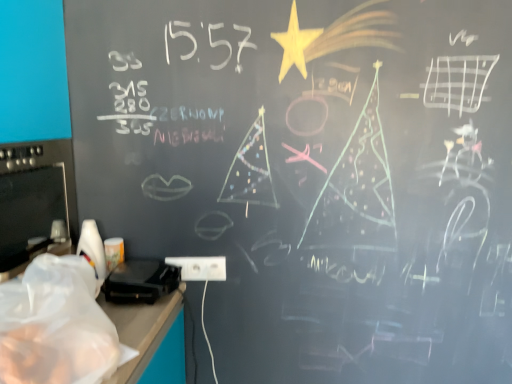
This screenshot has height=384, width=512. I want to click on transparent plastic bag at lower left, so click(x=154, y=335).

What do you see at coordinates (200, 268) in the screenshot? I see `white plastic electric outlet at lower center` at bounding box center [200, 268].

Locate an element on the screen. black plastic toaster at lower left is located at coordinates (141, 281).

Who is bigger, transparent plastic bag at lower left or white plastic electric outlet at lower center?

transparent plastic bag at lower left is bigger.

From the image's perspective, which one is positioned lower, transparent plastic bag at lower left or white plastic electric outlet at lower center?

white plastic electric outlet at lower center is shown below in the image.

Which object is further away from the camera taking this photo, transparent plastic bag at lower left or white plastic electric outlet at lower center?

white plastic electric outlet at lower center is behind.

Is transparent plastic bag at lower left positioned beyond the bounds of white plastic electric outlet at lower center?

Absolutely, transparent plastic bag at lower left is external to white plastic electric outlet at lower center.

Is white plastic electric outlet at lower center shorter than black plastic toaster at lower left?

Yes.

Is white plastic electric outlet at lower center not near black plastic toaster at lower left?

Actually, white plastic electric outlet at lower center and black plastic toaster at lower left are a little close together.

Based on the photo, is white plastic electric outlet at lower center bigger or smaller than black plastic toaster at lower left?

In the image, white plastic electric outlet at lower center appears to be smaller than black plastic toaster at lower left.

Which of these two, white plastic electric outlet at lower center or black plastic toaster at lower left, is wider?

With larger width is black plastic toaster at lower left.

Could you tell me if black plastic toaster at lower left is turned towards white plastic electric outlet at lower center?

No, black plastic toaster at lower left is not oriented towards white plastic electric outlet at lower center.

Is black plastic toaster at lower left placed right next to white plastic electric outlet at lower center?

black plastic toaster at lower left is not next to white plastic electric outlet at lower center, and they're not touching.

From a real-world perspective, is black plastic toaster at lower left over white plastic electric outlet at lower center?

Yes, from a real-world perspective, black plastic toaster at lower left is over white plastic electric outlet at lower center

Between black plastic toaster at lower left and white plastic electric outlet at lower center, which one has more height?

Standing taller between the two is black plastic toaster at lower left.

Does point (108, 284) come farther from viewer compared to point (159, 377)?

Yes.

Who is shorter, black plastic toaster at lower left or transparent plastic bag at lower left?

black plastic toaster at lower left is shorter.

Measure the distance from black plastic toaster at lower left to transparent plastic bag at lower left.

A distance of 5.01 inches exists between black plastic toaster at lower left and transparent plastic bag at lower left.

Who is more distant, black plastic toaster at lower left or transparent plastic bag at lower left?

black plastic toaster at lower left.

Which point is more distant from viewer, (x=215, y=260) or (x=176, y=378)?

The point (x=215, y=260) is more distant.

From the image's perspective, would you say white plastic electric outlet at lower center is positioned over transparent plastic bag at lower left?

Actually, white plastic electric outlet at lower center appears below transparent plastic bag at lower left in the image.

Considering the relative positions of white plastic electric outlet at lower center and transparent plastic bag at lower left in the image provided, is white plastic electric outlet at lower center to the right of transparent plastic bag at lower left from the viewer's perspective?

Yes, white plastic electric outlet at lower center is to the right of transparent plastic bag at lower left.

Which is in front, point (141, 339) or point (117, 275)?

The point (141, 339) is closer to the camera.

Find the location of a particular element. Image resolution: width=512 pixels, height=384 pixels. computer desk that appears in front of the black plastic toaster at lower left is located at coordinates (154, 335).

Is transparent plastic bag at lower left with black plastic toaster at lower left?

No, transparent plastic bag at lower left is not beside black plastic toaster at lower left.

From a real-world perspective, is transparent plastic bag at lower left positioned under black plastic toaster at lower left based on gravity?

No, from a real-world perspective, transparent plastic bag at lower left is not beneath black plastic toaster at lower left.

Where is `computer desk in front of the white plastic electric outlet at lower center`? The image size is (512, 384). computer desk in front of the white plastic electric outlet at lower center is located at coordinates (154, 335).

Image resolution: width=512 pixels, height=384 pixels. What are the coordinates of `equipment located below the white plastic electric outlet at lower center (from the image's perspective)` in the screenshot? It's located at (141, 281).

Which object lies nearer to the anchor point transparent plastic bag at lower left, black plastic toaster at lower left or white plastic electric outlet at lower center?

black plastic toaster at lower left is positioned closer to the anchor transparent plastic bag at lower left.

Which object lies nearer to the anchor point white plastic electric outlet at lower center, transparent plastic bag at lower left or black plastic toaster at lower left?

Based on the image, black plastic toaster at lower left appears to be nearer to white plastic electric outlet at lower center.

Looking at the image, which one is located closer to transparent plastic bag at lower left, white plastic electric outlet at lower center or black plastic toaster at lower left?

black plastic toaster at lower left is positioned closer to the anchor transparent plastic bag at lower left.

When comparing their distances from black plastic toaster at lower left, does white plastic electric outlet at lower center or transparent plastic bag at lower left seem further?

white plastic electric outlet at lower center is positioned further to the anchor black plastic toaster at lower left.

Estimate the real-world distances between objects in this image. Which object is closer to white plastic electric outlet at lower center, black plastic toaster at lower left or transparent plastic bag at lower left?

Among the two, black plastic toaster at lower left is located nearer to white plastic electric outlet at lower center.

Based on their spatial positions, is transparent plastic bag at lower left or white plastic electric outlet at lower center further from black plastic toaster at lower left?

Based on the image, white plastic electric outlet at lower center appears to be further to black plastic toaster at lower left.

Where is `equipment between transparent plastic bag at lower left and white plastic electric outlet at lower center in the front-back direction`? The image size is (512, 384). equipment between transparent plastic bag at lower left and white plastic electric outlet at lower center in the front-back direction is located at coordinates (141, 281).